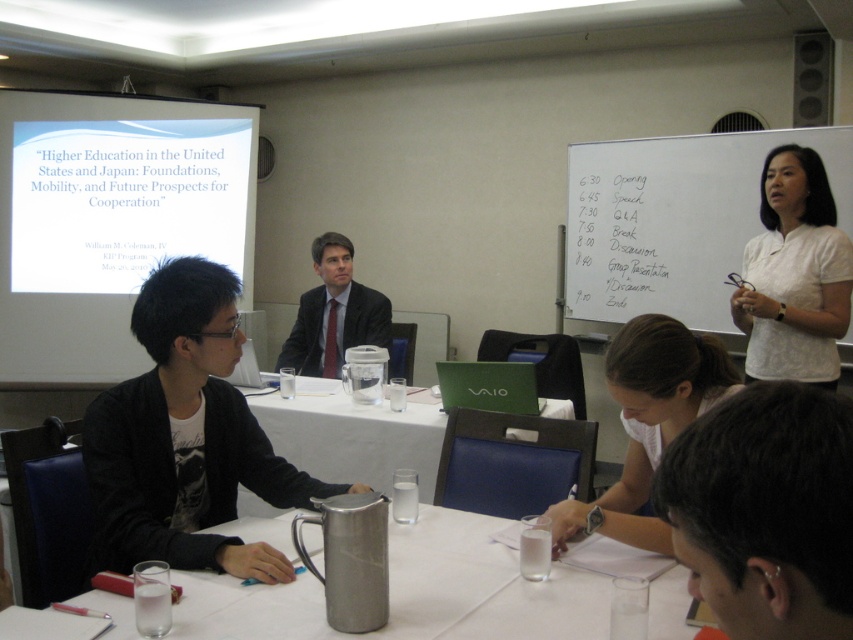
You are standing at the entrance of the meeting room and want to walk to the white plastic table at center. Based on the scene description, what direction should you move in to reach it?

The white plastic table at center is located at point (352, 435) in the scene, so you should move towards the center of the room to reach it.